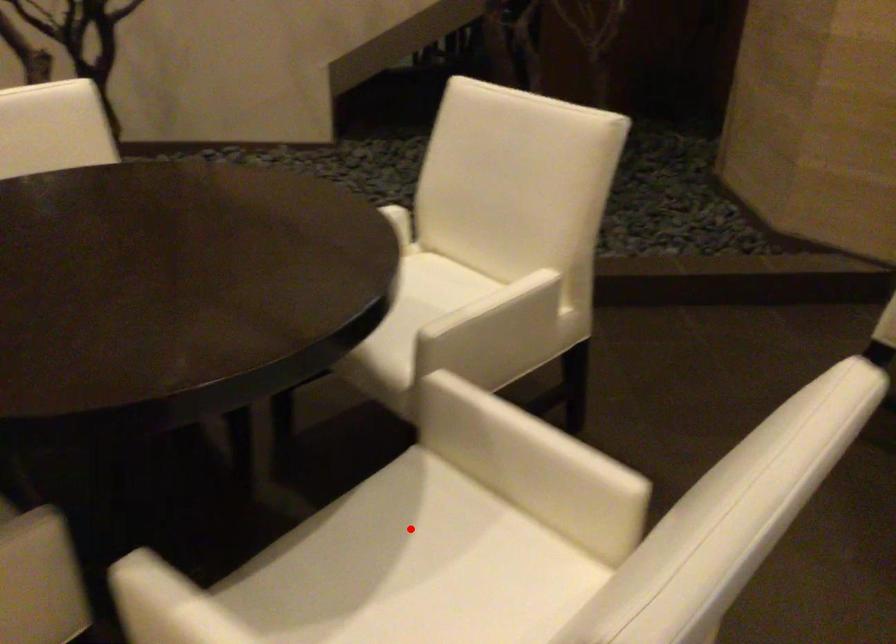
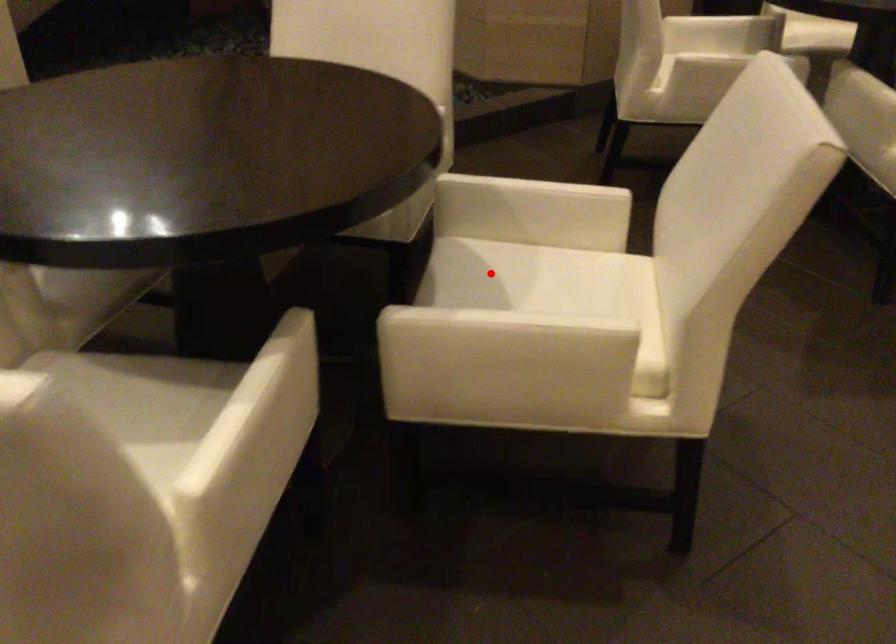
I am providing you with two images of the same scene from different viewpoints. A red point is marked on the first image and another point is marked on the second image. Do the highlighted points in image1 and image2 indicate the same real-world spot?

Yes